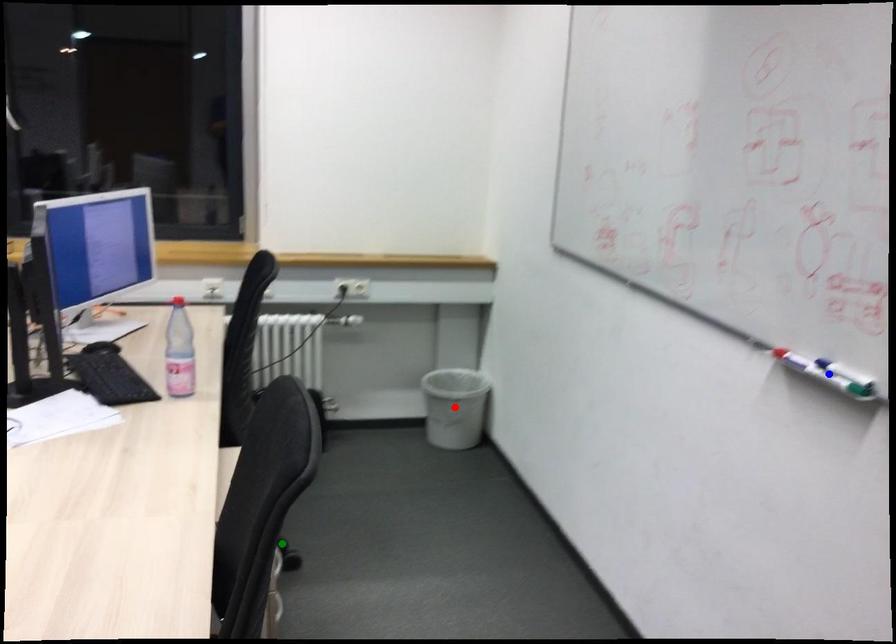
Order these from farthest to nearest:
A) red point
B) blue point
C) green point

red point, green point, blue point